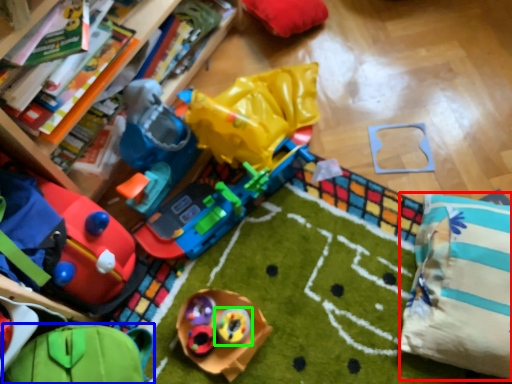
Question: Which object is the closest to the pillow (highlighted by a red box)? Choose among these: toy (highlighted by a blue box) or toy (highlighted by a green box).

Choices:
 (A) toy
 (B) toy

Answer: (B)